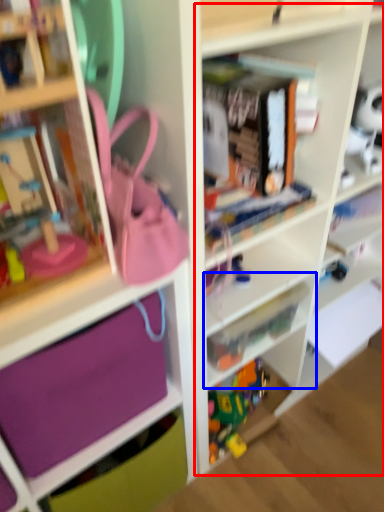
Question: Which point is further to the camera, cabinet (highlighted by a red box) or shelf (highlighted by a blue box)?

Choices:
 (A) cabinet
 (B) shelf

Answer: (B)